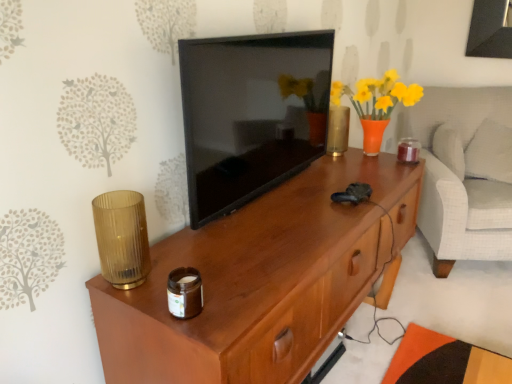
You are a GUI agent. You are given a task and a screenshot of the screen. Output one action in this format:
    pyautogui.click(x=<x>, y=<y>)
    Task: Click on the free space that is in between brown glass jar at lower center, the second candle holder when ordered from left to right, and translucent amber glass candle at right, which is counted as the first candle holder, starting from the right
    This screenshot has height=384, width=512.
    Given the screenshot: What is the action you would take?
    pyautogui.click(x=318, y=218)